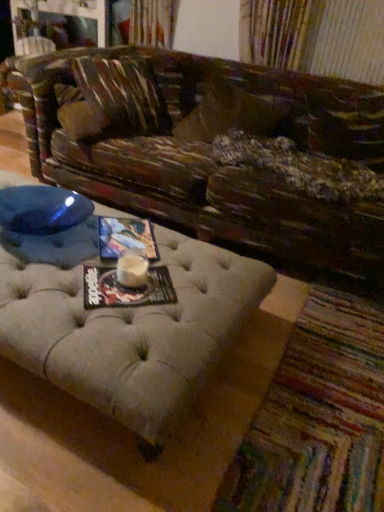
Question: From a real-world perspective, is leather-like brown pillow at center positioned above or below beige tufted ottoman at lower center?

Choices:
 (A) above
 (B) below

Answer: (A)

Question: Is leather-like brown pillow at center situated inside beige tufted ottoman at lower center or outside?

Choices:
 (A) outside
 (B) inside

Answer: (A)

Question: Which object is the closest to the leather-like brown pillow at center?

Choices:
 (A) matte paper magazine at center, which is counted as the first magazine, starting from the bottom
 (B) matte paper magazine at center, the 1th magazine when ordered from top to bottom
 (C) beige tufted ottoman at lower center

Answer: (B)

Question: Estimate the real-world distances between objects in this image. Which object is closer to the matte paper magazine at center, positioned as the second magazine in top-to-bottom order?

Choices:
 (A) beige tufted ottoman at lower center
 (B) leather-like brown pillow at center
 (C) matte paper magazine at center, positioned as the 1th magazine in back-to-front order

Answer: (C)